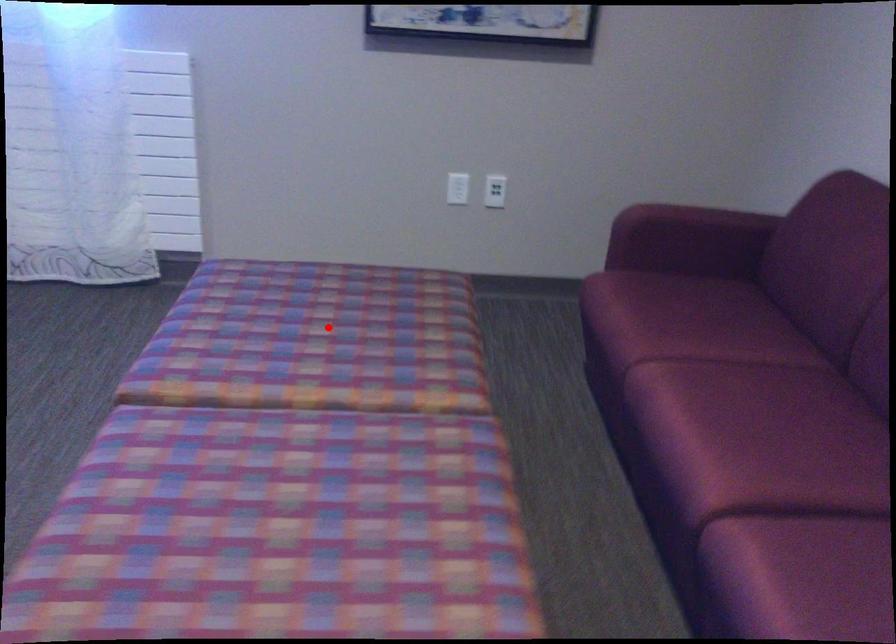
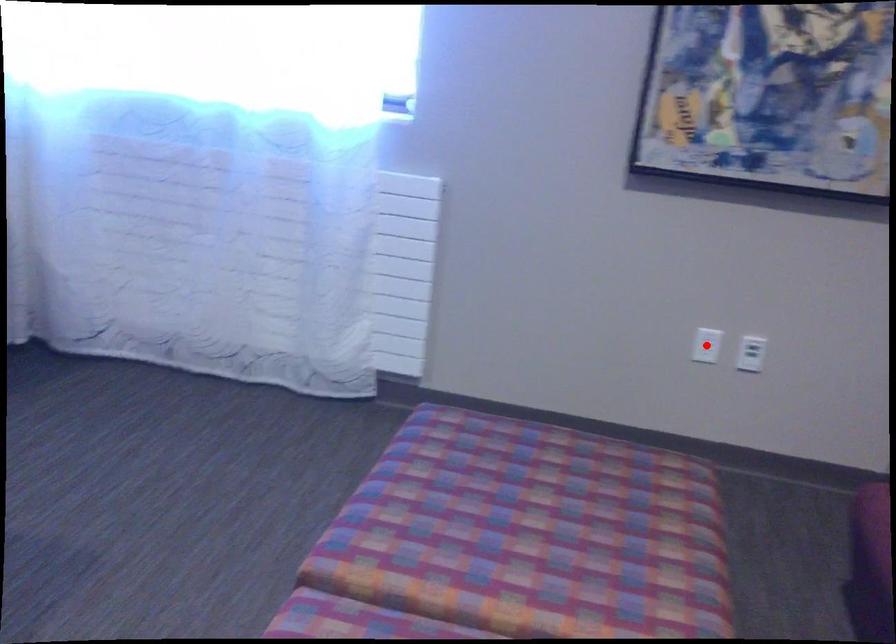
I am providing you with two images of the same scene from different viewpoints. A red point is marked on the first image and another point is marked on the second image. Does the point marked in image1 correspond to the same location as the one in image2?

No